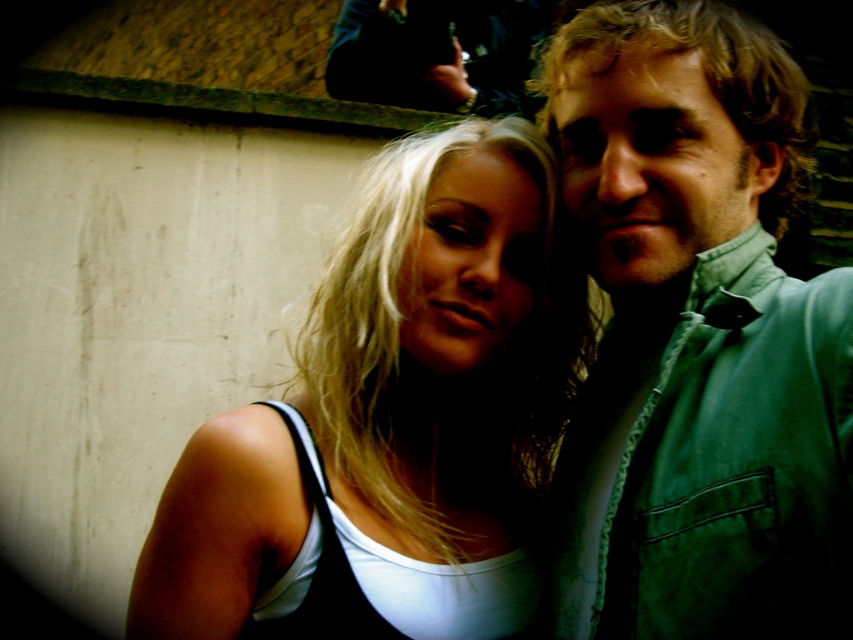
Question: Is the position of green textured shirt at right less distant than that of white matte tank top at center?

Choices:
 (A) no
 (B) yes

Answer: (B)

Question: Is green textured shirt at right behind white matte tank top at center?

Choices:
 (A) no
 (B) yes

Answer: (A)

Question: Is green textured shirt at right to the left of white matte tank top at center from the viewer's perspective?

Choices:
 (A) yes
 (B) no

Answer: (B)